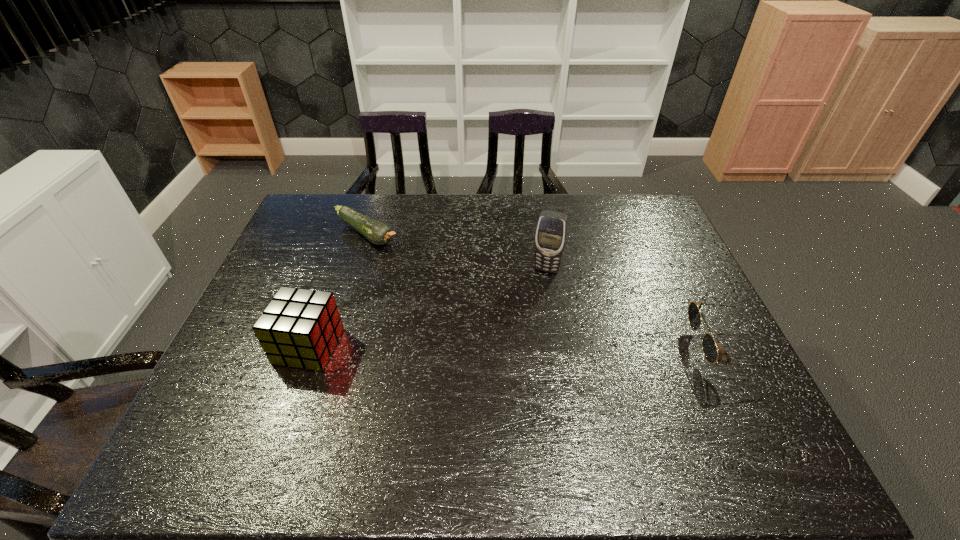
Identify the location of free space on the desktop that is between the cube and the sunglasses and is positioned at the blossom end of the farthest object. The height and width of the screenshot is (540, 960). (525, 347).

Locate an element on the screen. vacant spot on the desktop that is between the cube and the rightmost object and is positioned on the front face of the cellular telephone is located at coordinates pyautogui.click(x=521, y=347).